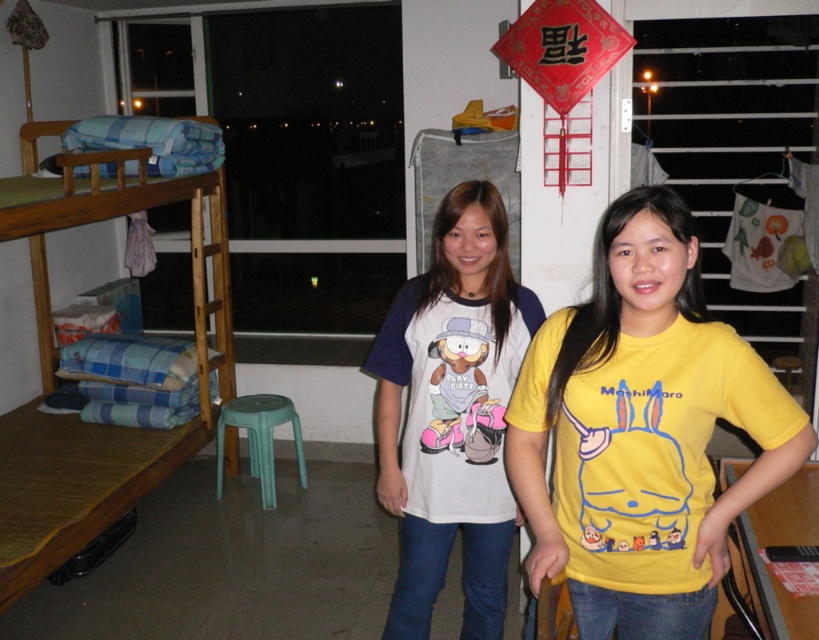
Does wooden bunk bed at left appear over green plastic stool at center?

Indeed, wooden bunk bed at left is positioned over green plastic stool at center.

Is wooden bunk bed at left bigger than green plastic stool at center?

Yes.

Where is `wooden bunk bed at left`? wooden bunk bed at left is located at coordinates (94, 424).

Locate an element on the screen. The height and width of the screenshot is (640, 819). wooden bunk bed at left is located at coordinates (94, 424).

Can you confirm if yellow cotton t-shirt at center is taller than green plastic stool at center?

Indeed, yellow cotton t-shirt at center has a greater height compared to green plastic stool at center.

Is yellow cotton t-shirt at center shorter than green plastic stool at center?

Incorrect, yellow cotton t-shirt at center's height does not fall short of green plastic stool at center's.

Find the location of a particular element. yellow cotton t-shirt at center is located at coordinates (641, 433).

Based on the photo, is yellow cotton t-shirt at center thinner than wooden bunk bed at left?

Indeed, yellow cotton t-shirt at center has a lesser width compared to wooden bunk bed at left.

Who is more forward, [573,550] or [17,438]?

Point [573,550]

You are a GUI agent. You are given a task and a screenshot of the screen. Output one action in this format:
    pyautogui.click(x=<x>, y=<y>)
    Task: Click on the yellow cotton t-shirt at center
    
    Given the screenshot: What is the action you would take?
    pyautogui.click(x=641, y=433)